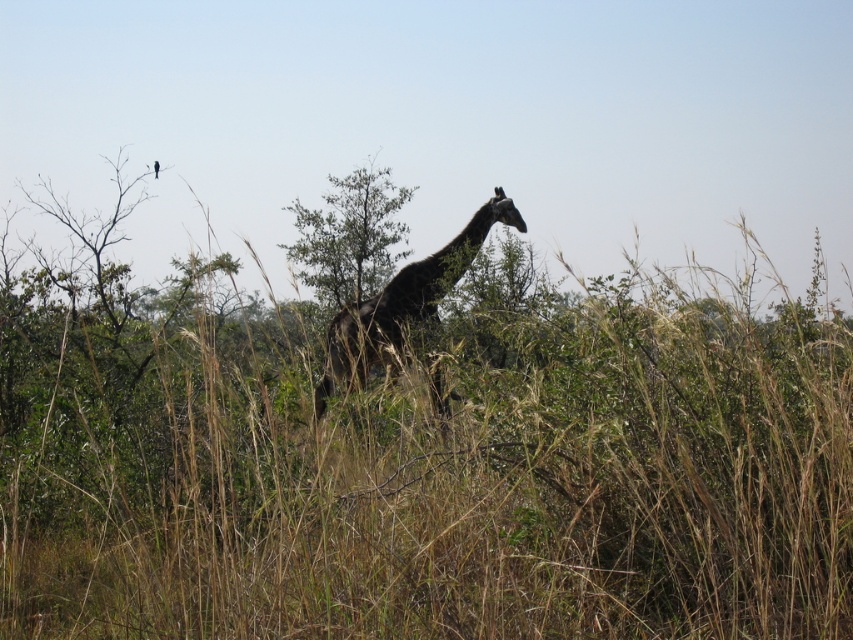
Which is above, dark brown textured giraffe at center or green leafy tree at center?

green leafy tree at center

Who is taller, dark brown textured giraffe at center or green leafy tree at center?

Standing taller between the two is dark brown textured giraffe at center.

Locate an element on the screen. dark brown textured giraffe at center is located at coordinates (403, 305).

This screenshot has height=640, width=853. I want to click on dark brown textured giraffe at center, so click(403, 305).